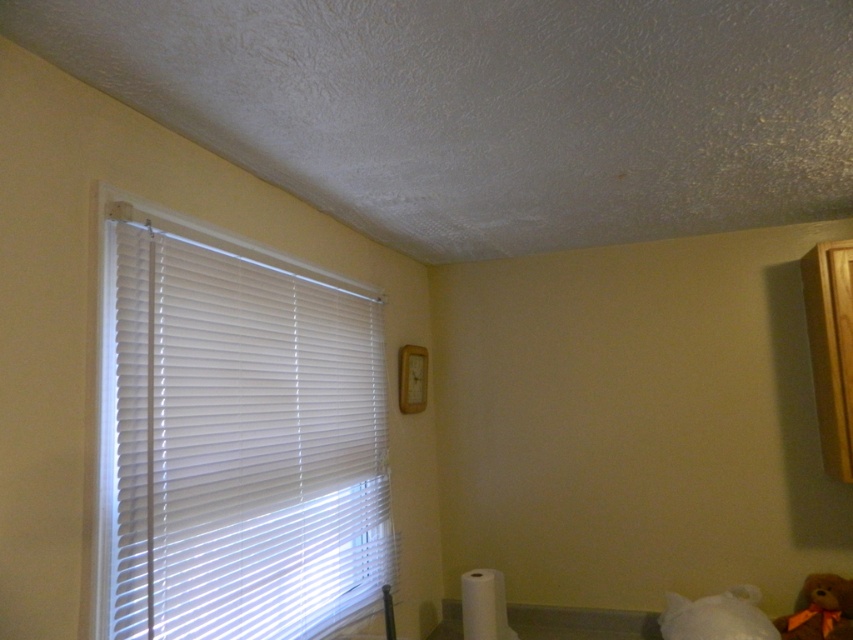
Is white plastic blinds at left smaller than brown plush teddy bear at lower right?

Incorrect, white plastic blinds at left is not smaller in size than brown plush teddy bear at lower right.

Does point (126, 337) come behind point (822, 624)?

No, (126, 337) is closer to viewer.

I want to click on white plastic blinds at left, so click(235, 436).

At what (x,y) coordinates should I click in order to perform the action: click on white plastic blinds at left. Please return your answer as a coordinate pair (x, y). Looking at the image, I should click on (235, 436).